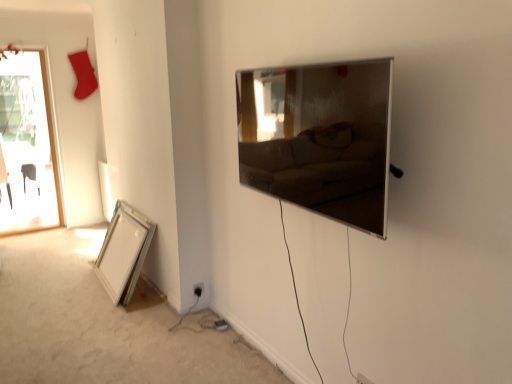
Question: Which direction should I rotate to look at white plastic electric outlet at lower center, the second electric outlet viewed from the back, — up or down?

Choices:
 (A) up
 (B) down

Answer: (B)

Question: Is black plastic electric outlet at lower center, the 1th electric outlet when ordered from left to right, positioned behind white plastic electric outlet at lower center, which is the 1th electric outlet from right to left?

Choices:
 (A) yes
 (B) no

Answer: (A)

Question: Is black plastic electric outlet at lower center, which ranks as the second electric outlet in bottom-to-top order, not within white plastic electric outlet at lower center, which is counted as the 2th electric outlet, starting from the top?

Choices:
 (A) no
 (B) yes

Answer: (B)

Question: Does black plastic electric outlet at lower center, arranged as the 1th electric outlet when viewed from the back, touch white plastic electric outlet at lower center, which is the 1th electric outlet from right to left?

Choices:
 (A) yes
 (B) no

Answer: (B)

Question: Is black plastic electric outlet at lower center, which is the 2th electric outlet in right-to-left order, positioned far away from white plastic electric outlet at lower center, marked as the 2th electric outlet in a left-to-right arrangement?

Choices:
 (A) no
 (B) yes

Answer: (B)

Question: Is black plastic electric outlet at lower center, the 1th electric outlet when ordered from left to right, wider than white plastic electric outlet at lower center, which is counted as the 2th electric outlet, starting from the top?

Choices:
 (A) yes
 (B) no

Answer: (B)

Question: From a real-world perspective, is black plastic electric outlet at lower center, the 1th electric outlet when ordered from left to right, on white plastic electric outlet at lower center, the second electric outlet viewed from the back?

Choices:
 (A) yes
 (B) no

Answer: (B)

Question: Does silver metallic picture frame at lower left, the 1th picture frame when ordered from bottom to top, have a lesser height compared to white plastic electric outlet at lower center, the first electric outlet when ordered from front to back?

Choices:
 (A) no
 (B) yes

Answer: (A)

Question: Is silver metallic picture frame at lower left, which ranks as the 2th picture frame in top-to-bottom order, taller than white plastic electric outlet at lower center, the second electric outlet viewed from the back?

Choices:
 (A) no
 (B) yes

Answer: (B)

Question: Can you confirm if silver metallic picture frame at lower left, which is counted as the second picture frame, starting from the right, is positioned to the right of white plastic electric outlet at lower center, the second electric outlet viewed from the back?

Choices:
 (A) yes
 (B) no

Answer: (B)

Question: Is silver metallic picture frame at lower left, positioned as the second picture frame in front-to-back order, not within white plastic electric outlet at lower center, marked as the 2th electric outlet in a left-to-right arrangement?

Choices:
 (A) no
 (B) yes

Answer: (B)

Question: Is silver metallic picture frame at lower left, which ranks as the 2th picture frame in top-to-bottom order, touching white plastic electric outlet at lower center, positioned as the 1th electric outlet in bottom-to-top order?

Choices:
 (A) yes
 (B) no

Answer: (B)

Question: Is silver metallic picture frame at lower left, which ranks as the 2th picture frame in top-to-bottom order, in front of white plastic electric outlet at lower center, marked as the 2th electric outlet in a left-to-right arrangement?

Choices:
 (A) yes
 (B) no

Answer: (B)

Question: Is silver metallic picture frame at lower left, which is counted as the second picture frame, starting from the right, located outside satin silver tv at upper right, which is counted as the 2th picture frame, starting from the back?

Choices:
 (A) yes
 (B) no

Answer: (A)